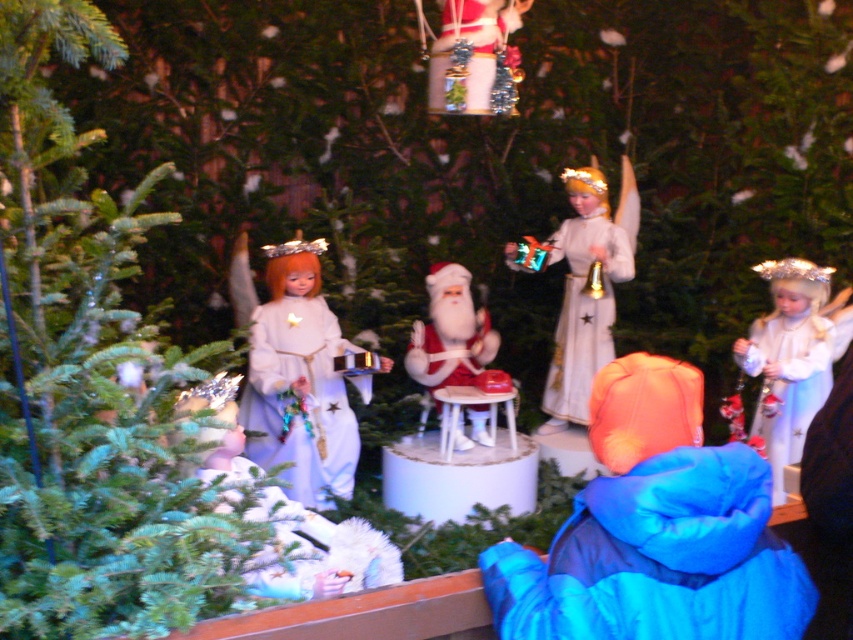
You are a visitor at the Christmas display and want to take a photo of both the white glossy doll at upper right and the shiny silver ornament at upper center. Which object should you focus on first if you want to capture them both in the same frame without moving your camera?

The white glossy doll at upper right is positioned on the right side of the shiny silver ornament at upper center, so you should focus on the shiny silver ornament at upper center first to ensure both are in the frame.